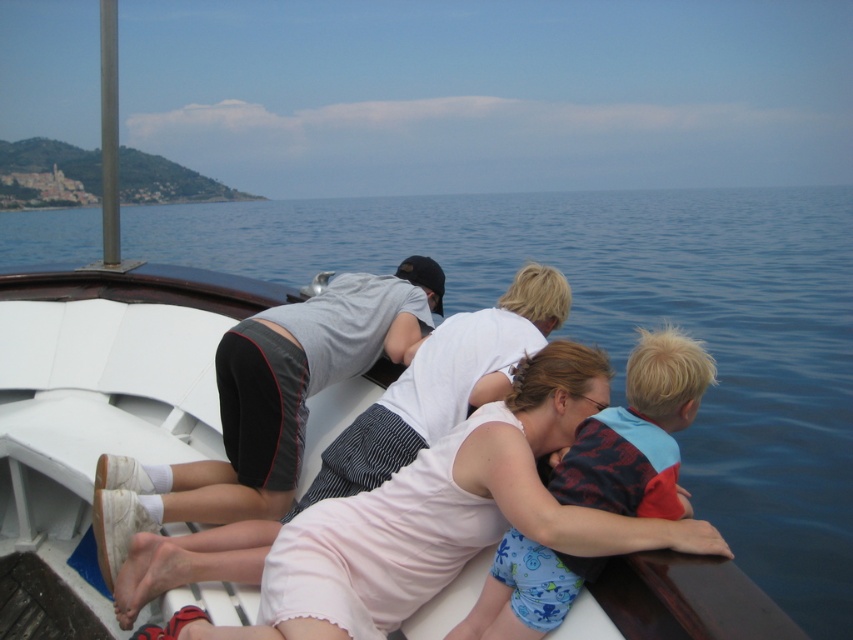
Question: Considering the relative positions of blue water at center and white cotton dress at center in the image provided, where is blue water at center located with respect to white cotton dress at center?

Choices:
 (A) right
 (B) left

Answer: (B)

Question: Is white cotton dress at center thinner than blue fabric life vest at center?

Choices:
 (A) yes
 (B) no

Answer: (B)

Question: Which of the following is the closest to the observer?

Choices:
 (A) white cotton dress at center
 (B) blue water at center
 (C) blue fabric life vest at center

Answer: (A)

Question: From the image, what is the correct spatial relationship of white cotton dress at center in relation to blue fabric life vest at center?

Choices:
 (A) below
 (B) above

Answer: (A)

Question: Which of the following is the farthest from the observer?

Choices:
 (A) blue water at center
 (B) blue fabric life vest at center

Answer: (A)

Question: Among these points, which one is nearest to the camera?

Choices:
 (A) tap(805, 458)
 (B) tap(679, 336)
 (C) tap(422, 492)

Answer: (B)